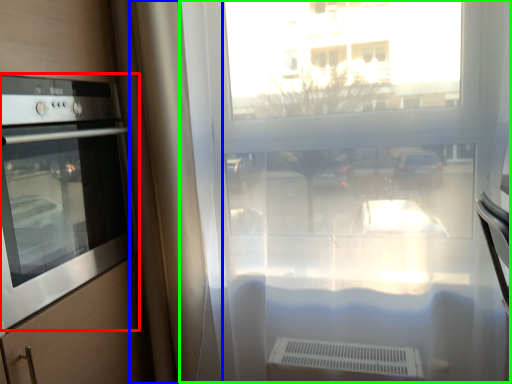
Question: Which object is the closest to the home appliance (highlighted by a red box)? Choose among these: curtain (highlighted by a blue box) or window frame (highlighted by a green box).

Choices:
 (A) curtain
 (B) window frame

Answer: (A)